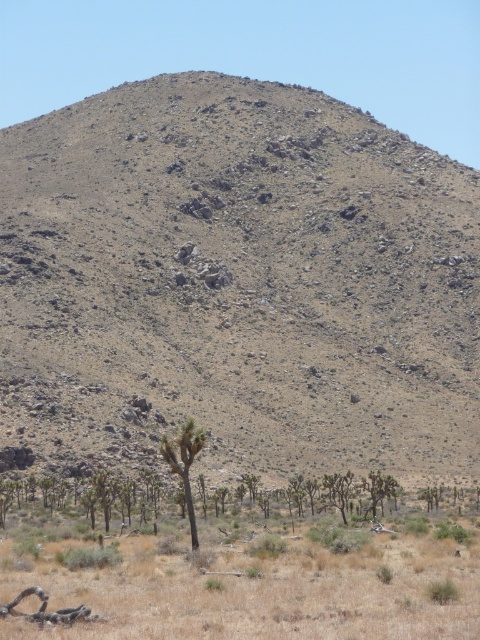
Which is in front, point (25, 435) or point (187, 504)?

Point (187, 504)

Can you confirm if dull brown rocky hillside at center is shorter than green leafy tree at lower center?

Incorrect, dull brown rocky hillside at center's height does not fall short of green leafy tree at lower center's.

Does point (20, 211) come closer to viewer compared to point (195, 440)?

That is False.

Locate an element on the screen. The image size is (480, 640). dull brown rocky hillside at center is located at coordinates (238, 284).

Does dull brown rocky hillside at center have a lesser width compared to dry grass at lower center?

No, dull brown rocky hillside at center is not thinner than dry grass at lower center.

Between dull brown rocky hillside at center and dry grass at lower center, which one has more height?

dull brown rocky hillside at center

Describe the element at coordinates (238, 284) in the screenshot. I see `dull brown rocky hillside at center` at that location.

I want to click on dull brown rocky hillside at center, so click(238, 284).

Between dry grass at lower center and green leafy tree at lower center, which one has less height?

dry grass at lower center

Can you confirm if dry grass at lower center is thinner than green leafy tree at lower center?

No, dry grass at lower center is not thinner than green leafy tree at lower center.

The width and height of the screenshot is (480, 640). What do you see at coordinates (256, 584) in the screenshot? I see `dry grass at lower center` at bounding box center [256, 584].

Find the location of a particular element. This screenshot has width=480, height=640. dry grass at lower center is located at coordinates (256, 584).